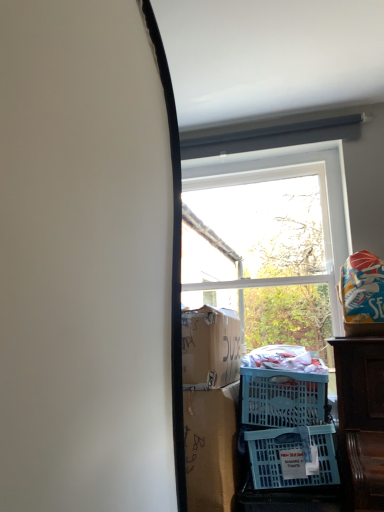
This screenshot has height=512, width=384. Identify the location of blue plastic basket at lower right. (292, 457).

What do you see at coordinates (292, 457) in the screenshot?
I see `blue plastic basket at lower right` at bounding box center [292, 457].

This screenshot has height=512, width=384. What do you see at coordinates (269, 241) in the screenshot?
I see `transparent glass window at center` at bounding box center [269, 241].

Identify the location of transparent glass window at center. (269, 241).

Locate an element on the screen. The height and width of the screenshot is (512, 384). blue plastic basket at lower right is located at coordinates (292, 457).

Consider the image. Can you confirm if blue plastic basket at lower right is positioned to the right of transparent glass window at center?

In fact, blue plastic basket at lower right is to the left of transparent glass window at center.

In the image, is blue plastic basket at lower right positioned in front of or behind transparent glass window at center?

In the image, blue plastic basket at lower right appears in front of transparent glass window at center.

Which is closer, (255, 437) or (325, 354)?

Point (255, 437)

From the image's perspective, between blue plastic basket at lower right and transparent glass window at center, which one is located above?

transparent glass window at center is shown above in the image.

From a real-world perspective, which is physically below, blue plastic basket at lower right or transparent glass window at center?

blue plastic basket at lower right.

Between blue plastic basket at lower right and transparent glass window at center, which one has smaller width?

Thinner between the two is transparent glass window at center.

Considering the relative sizes of blue plastic basket at lower right and transparent glass window at center in the image provided, is blue plastic basket at lower right taller than transparent glass window at center?

No.

Between blue plastic basket at lower right and transparent glass window at center, which one has smaller size?

Smaller between the two is blue plastic basket at lower right.

Is blue plastic basket at lower right located outside transparent glass window at center?

blue plastic basket at lower right is positioned outside transparent glass window at center.

Is blue plastic basket at lower right far away from transparent glass window at center?

blue plastic basket at lower right is positioned a significant distance from transparent glass window at center.

Does blue plastic basket at lower right turn towards transparent glass window at center?

No, blue plastic basket at lower right is not aimed at transparent glass window at center.

Where is `basket on the left of transparent glass window at center`? basket on the left of transparent glass window at center is located at coordinates (292, 457).

Which object is positioned more to the left, transparent glass window at center or blue plastic basket at lower right?

blue plastic basket at lower right.

Is transparent glass window at center in front of or behind blue plastic basket at lower right in the image?

Clearly, transparent glass window at center is behind blue plastic basket at lower right.

Is point (301, 214) positioned before point (284, 461)?

No, it is behind (284, 461).

From the image's perspective, is transparent glass window at center positioned above or below blue plastic basket at lower right?

From the image's perspective, transparent glass window at center appears above blue plastic basket at lower right.

From a real-world perspective, is transparent glass window at center above or below blue plastic basket at lower right?

In terms of real-world spatial position, transparent glass window at center is above blue plastic basket at lower right.

Between transparent glass window at center and blue plastic basket at lower right, which one has larger width?

blue plastic basket at lower right is wider.

From the picture: Between transparent glass window at center and blue plastic basket at lower right, which one has less height?

blue plastic basket at lower right is shorter.

Is transparent glass window at center smaller than blue plastic basket at lower right?

No, transparent glass window at center is not smaller than blue plastic basket at lower right.

Is transparent glass window at center inside or outside of blue plastic basket at lower right?

transparent glass window at center cannot be found inside blue plastic basket at lower right.

Is transparent glass window at center far away from blue plastic basket at lower right?

Yes.

From the picture: Is transparent glass window at center turned away from blue plastic basket at lower right?

No.

Can you tell me how much transparent glass window at center and blue plastic basket at lower right differ in facing direction?

The angle between the facing direction of transparent glass window at center and the facing direction of blue plastic basket at lower right is 0.727 degrees.

How much distance is there between transparent glass window at center and blue plastic basket at lower right?

transparent glass window at center and blue plastic basket at lower right are 1.10 meters apart from each other.

Where is `window on the right of blue plastic basket at lower right`? window on the right of blue plastic basket at lower right is located at coordinates (269, 241).

Identify the location of basket that appears below the transparent glass window at center (from the image's perspective). (292, 457).

Find the location of a particular element. This screenshot has height=512, width=384. window above the blue plastic basket at lower right (from the image's perspective) is located at coordinates (269, 241).